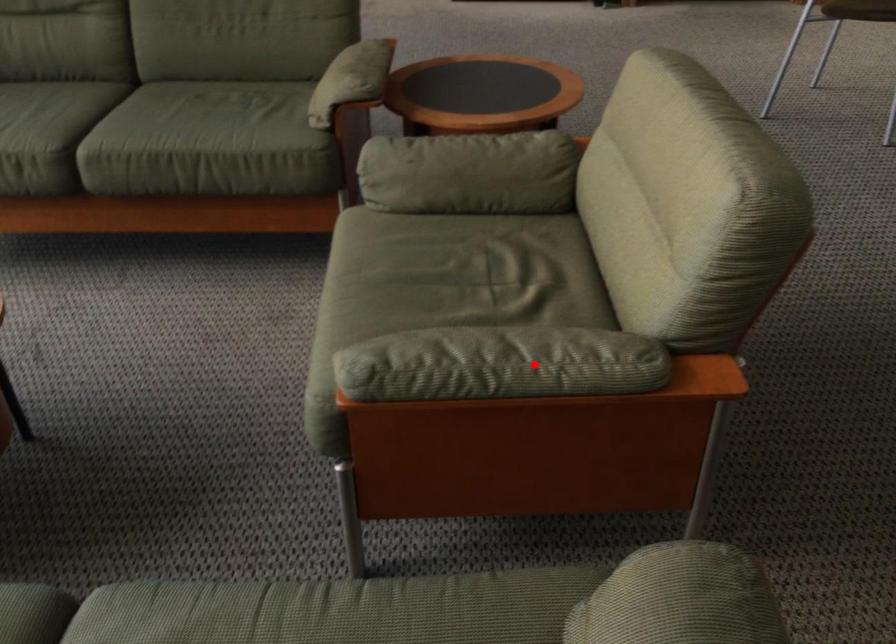
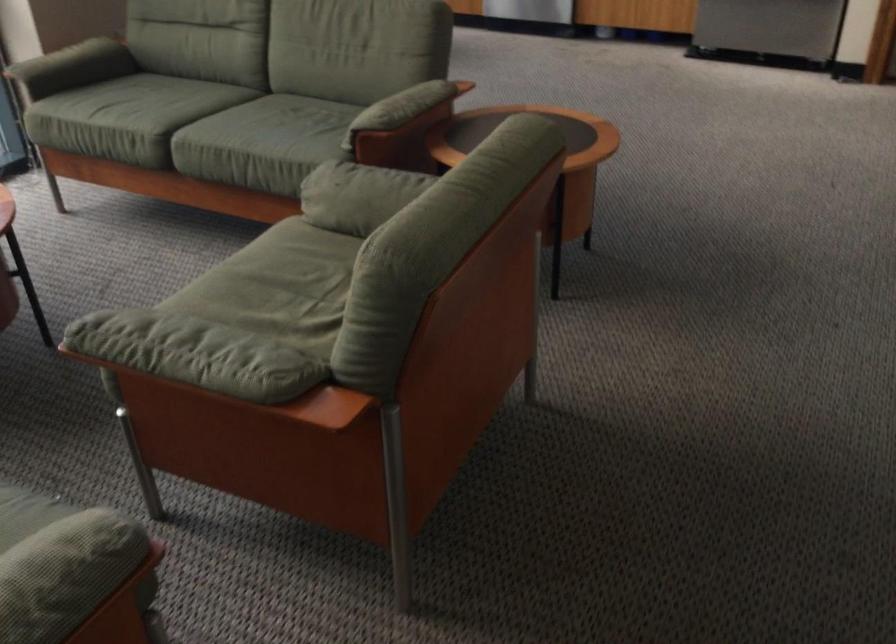
Question: I am providing you with two images of the same scene from different viewpoints. A red point is marked on the first image. At the location where the point appears in image 1, is it still visible in image 2?

Choices:
 (A) Yes
 (B) No

Answer: (A)